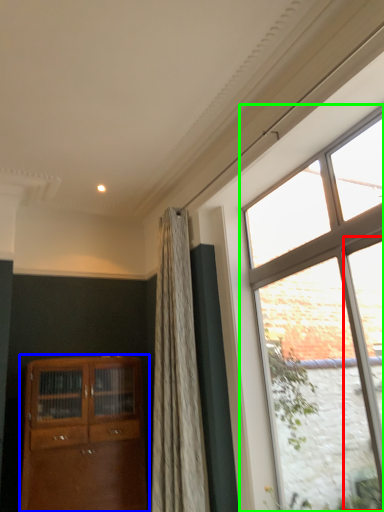
Question: Which object is positioned closest to glass door (highlighted by a red box)? Select from cabinetry (highlighted by a blue box) and window (highlighted by a green box).

Choices:
 (A) cabinetry
 (B) window

Answer: (B)